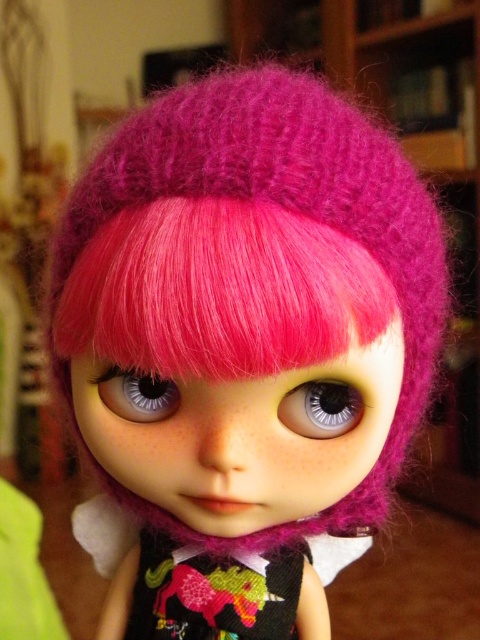
Can you confirm if knitted fabric dress at center is shorter than satin silver eye at center?

No.

Is point (239, 596) positioned before point (330, 392)?

No, (239, 596) is behind (330, 392).

Which is in front, point (297, 596) or point (340, 420)?

Point (340, 420) is more forward.

This screenshot has height=640, width=480. What are the coordinates of `knitted fabric dress at center` in the screenshot? It's located at (215, 593).

Who is shorter, knitted fabric dress at center or satin blue eye at center?

Standing shorter between the two is satin blue eye at center.

Is knitted fabric dress at center below satin blue eye at center?

Correct, knitted fabric dress at center is located below satin blue eye at center.

Does point (271, 577) lie in front of point (132, 372)?

No, (271, 577) is further to viewer.

The height and width of the screenshot is (640, 480). Find the location of `knitted fabric dress at center`. knitted fabric dress at center is located at coordinates (215, 593).

Is satin silver eye at center above satin blue eye at center?

No.

Which of these two, satin silver eye at center or satin blue eye at center, stands shorter?

With less height is satin blue eye at center.

The image size is (480, 640). Find the location of `satin silver eye at center`. satin silver eye at center is located at coordinates (321, 408).